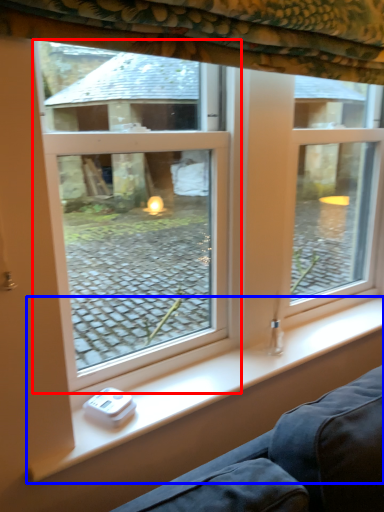
Question: Which point is further to the camera, window (highlighted by a red box) or window sill (highlighted by a blue box)?

Choices:
 (A) window
 (B) window sill

Answer: (B)